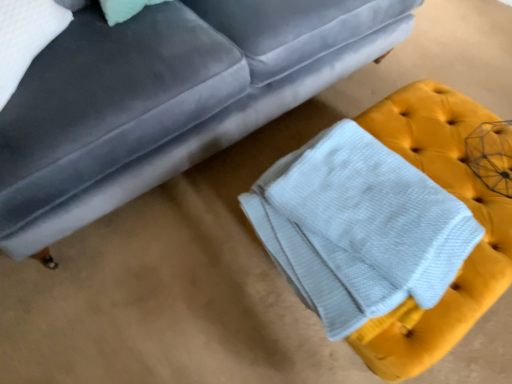
In order to face velvet gray couch at upper center, should I rotate leftwards or rightwards?

Rotate left and turn 10.320 degrees.

Describe the element at coordinates (165, 98) in the screenshot. I see `velvet gray couch at upper center` at that location.

At what (x,y) coordinates should I click in order to perform the action: click on velvet gray couch at upper center. Please return your answer as a coordinate pair (x, y). Image resolution: width=512 pixels, height=384 pixels. Looking at the image, I should click on (165, 98).

This screenshot has height=384, width=512. What are the coordinates of `white textured bath towel at lower right` in the screenshot? It's located at (358, 228).

Image resolution: width=512 pixels, height=384 pixels. What do you see at coordinates (358, 228) in the screenshot?
I see `white textured bath towel at lower right` at bounding box center [358, 228].

You are a GUI agent. You are given a task and a screenshot of the screen. Output one action in this format:
    pyautogui.click(x=<x>, y=<y>)
    Task: Click on the velvet gray couch at upper center
    The width and height of the screenshot is (512, 384).
    Given the screenshot: What is the action you would take?
    pyautogui.click(x=165, y=98)

Which is more to the right, white textured bath towel at lower right or velvet gray couch at upper center?

From the viewer's perspective, white textured bath towel at lower right appears more on the right side.

Is the position of white textured bath towel at lower right less distant than that of velvet gray couch at upper center?

No, it is not.

Is point (372, 221) positioned in front of point (243, 8)?

That is True.

From the image's perspective, is white textured bath towel at lower right over velvet gray couch at upper center?

Incorrect, from the image's perspective, white textured bath towel at lower right is lower than velvet gray couch at upper center.

From a real-world perspective, relative to velvet gray couch at upper center, is white textured bath towel at lower right vertically above or below?

Clearly, from a real-world perspective, white textured bath towel at lower right is below velvet gray couch at upper center.

Is white textured bath towel at lower right thinner than velvet gray couch at upper center?

Correct, the width of white textured bath towel at lower right is less than that of velvet gray couch at upper center.

In terms of height, does white textured bath towel at lower right look taller or shorter compared to velvet gray couch at upper center?

Considering their sizes, white textured bath towel at lower right has less height than velvet gray couch at upper center.

Does white textured bath towel at lower right have a smaller size compared to velvet gray couch at upper center?

Yes.

Which is correct: white textured bath towel at lower right is inside velvet gray couch at upper center, or outside of it?

white textured bath towel at lower right is not enclosed by velvet gray couch at upper center.

Is white textured bath towel at lower right directly adjacent to velvet gray couch at upper center?

No.

Is white textured bath towel at lower right facing towards velvet gray couch at upper center?

No, white textured bath towel at lower right is not facing towards velvet gray couch at upper center.

Find the location of a particular element. The height and width of the screenshot is (384, 512). studio couch lying above the white textured bath towel at lower right (from the image's perspective) is located at coordinates (165, 98).

From the picture: Can you confirm if velvet gray couch at upper center is positioned to the left of white textured bath towel at lower right?

Yes, velvet gray couch at upper center is to the left of white textured bath towel at lower right.

Is velvet gray couch at upper center positioned in front of white textured bath towel at lower right?

Yes, velvet gray couch at upper center is in front of white textured bath towel at lower right.

Between point (195, 85) and point (334, 322), which one is positioned behind?

The point (195, 85) is farther from the camera.

Based on the photo, from the image's perspective, would you say velvet gray couch at upper center is shown under white textured bath towel at lower right?

No, from the image's perspective, velvet gray couch at upper center is not below white textured bath towel at lower right.

From a real-world perspective, does velvet gray couch at upper center sit lower than white textured bath towel at lower right?

No, from a real-world perspective, velvet gray couch at upper center is not below white textured bath towel at lower right.

In terms of width, does velvet gray couch at upper center look wider or thinner when compared to white textured bath towel at lower right?

Considering their sizes, velvet gray couch at upper center looks broader than white textured bath towel at lower right.

Can you confirm if velvet gray couch at upper center is taller than white textured bath towel at lower right?

Yes, velvet gray couch at upper center is taller than white textured bath towel at lower right.

Who is smaller, velvet gray couch at upper center or white textured bath towel at lower right?

Smaller between the two is white textured bath towel at lower right.

In the scene shown: Can we say velvet gray couch at upper center lies outside white textured bath towel at lower right?

Yes, velvet gray couch at upper center is located beyond the bounds of white textured bath towel at lower right.

Is the surface of velvet gray couch at upper center in direct contact with white textured bath towel at lower right?

velvet gray couch at upper center and white textured bath towel at lower right are clearly separated.

Is velvet gray couch at upper center looking in the opposite direction of white textured bath towel at lower right?

No, velvet gray couch at upper center is not facing away from white textured bath towel at lower right.

Can you tell me how much velvet gray couch at upper center and white textured bath towel at lower right differ in facing direction?

They differ by 89.5 degrees in their facing directions.

This screenshot has height=384, width=512. Identify the location of bath towel below the velvet gray couch at upper center (from a real-world perspective). (358, 228).

The image size is (512, 384). I want to click on studio couch that appears on the left of white textured bath towel at lower right, so tap(165, 98).

Where is `bath towel on the right side of velvet gray couch at upper center`? The image size is (512, 384). bath towel on the right side of velvet gray couch at upper center is located at coordinates pyautogui.click(x=358, y=228).